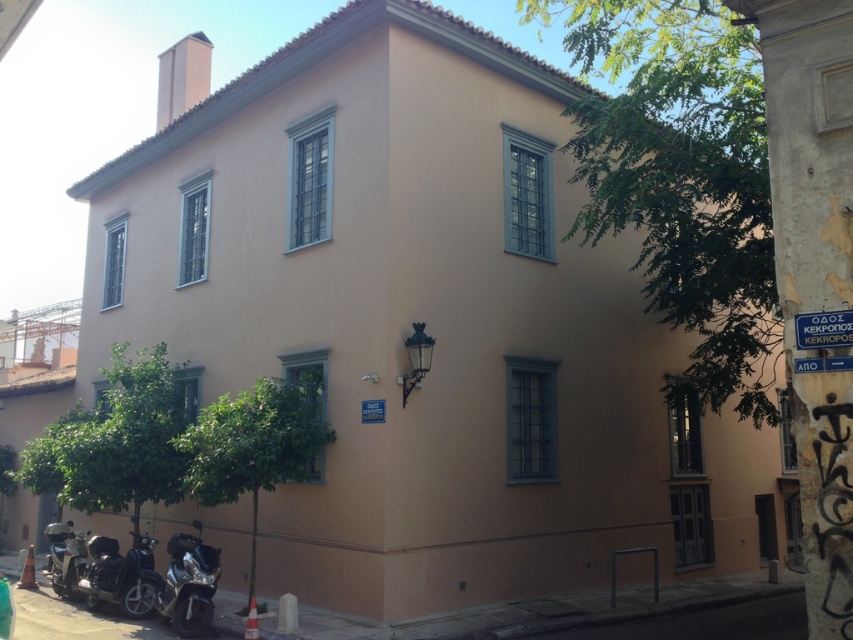
Question: Can you confirm if shiny chrome motorcycle at lower left is smaller than shiny black motorcycle at lower left?

Choices:
 (A) yes
 (B) no

Answer: (B)

Question: Among these points, which one is nearest to the camera?

Choices:
 (A) (68, 563)
 (B) (120, 560)
 (C) (161, 589)

Answer: (C)

Question: Can you confirm if shiny chrome motorcycle at lower left is thinner than shiny silver motorcycle at lower left?

Choices:
 (A) no
 (B) yes

Answer: (A)

Question: Observing the image, what is the correct spatial positioning of shiny black motorcycle at lower left in reference to shiny silver motorcycle at lower left?

Choices:
 (A) left
 (B) right

Answer: (B)

Question: Which object appears closest to the camera in this image?

Choices:
 (A) shiny silver motorcycle at lower left
 (B) shiny black motorcycle at lower left
 (C) shiny chrome motorcycle at lower left

Answer: (B)

Question: Which point is farther from the camera taking this photo?

Choices:
 (A) (105, 579)
 (B) (161, 609)
 (C) (68, 550)

Answer: (C)